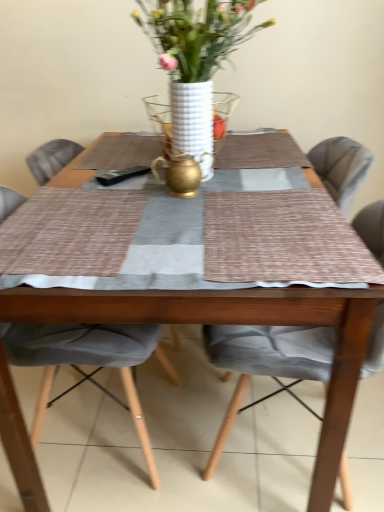
Question: Is wooden table at center smaller than white ceramic vase at center?

Choices:
 (A) yes
 (B) no

Answer: (B)

Question: Is wooden table at center far away from white ceramic vase at center?

Choices:
 (A) no
 (B) yes

Answer: (A)

Question: Does wooden table at center have a lesser height compared to white ceramic vase at center?

Choices:
 (A) yes
 (B) no

Answer: (B)

Question: Considering the relative sizes of wooden table at center and white ceramic vase at center in the image provided, is wooden table at center taller than white ceramic vase at center?

Choices:
 (A) no
 (B) yes

Answer: (B)

Question: Can you confirm if wooden table at center is wider than white ceramic vase at center?

Choices:
 (A) yes
 (B) no

Answer: (A)

Question: Is textured gray cushion at center, which is the 1th chair in right-to-left order, situated inside gray fabric chair at center, placed as the 1th chair when sorted from left to right, or outside?

Choices:
 (A) inside
 (B) outside

Answer: (B)

Question: Is textured gray cushion at center, which is the 1th chair in right-to-left order, bigger or smaller than gray fabric chair at center, the 2th chair in the right-to-left sequence?

Choices:
 (A) big
 (B) small

Answer: (B)

Question: Would you say textured gray cushion at center, which is the 1th chair in right-to-left order, is to the left or to the right of gray fabric chair at center, the 2th chair in the right-to-left sequence, in the picture?

Choices:
 (A) left
 (B) right

Answer: (B)

Question: In the image, is textured gray cushion at center, which is the 1th chair in right-to-left order, positioned in front of or behind gray fabric chair at center, the 2th chair in the right-to-left sequence?

Choices:
 (A) front
 (B) behind

Answer: (A)

Question: Looking at their shapes, would you say textured gray cushion at center, acting as the 2th chair starting from the left, is wider or thinner than wooden table at center?

Choices:
 (A) wide
 (B) thin

Answer: (B)

Question: Is point (223, 437) closer or farther from the camera than point (231, 308)?

Choices:
 (A) closer
 (B) farther

Answer: (B)

Question: Is textured gray cushion at center, which is the 1th chair in right-to-left order, in front of or behind wooden table at center in the image?

Choices:
 (A) front
 (B) behind

Answer: (B)

Question: From a real-world perspective, is textured gray cushion at center, acting as the 2th chair starting from the left, above or below wooden table at center?

Choices:
 (A) above
 (B) below

Answer: (B)

Question: Based on their sizes in the image, would you say wooden table at center is bigger or smaller than white textured vase at center?

Choices:
 (A) big
 (B) small

Answer: (A)

Question: Considering the positions of wooden table at center and white textured vase at center in the image, is wooden table at center taller or shorter than white textured vase at center?

Choices:
 (A) tall
 (B) short

Answer: (A)